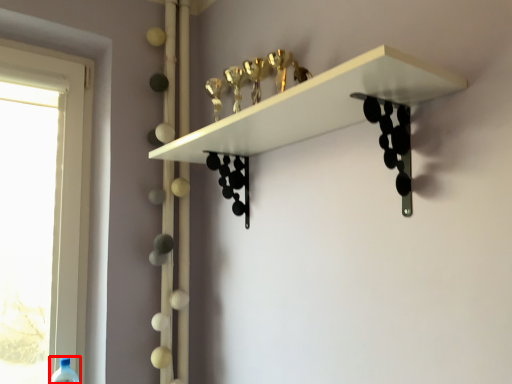
Question: From the image's perspective, what is the correct spatial positioning of wine bottle (annotated by the red box) in reference to shelf?

Choices:
 (A) below
 (B) above

Answer: (A)